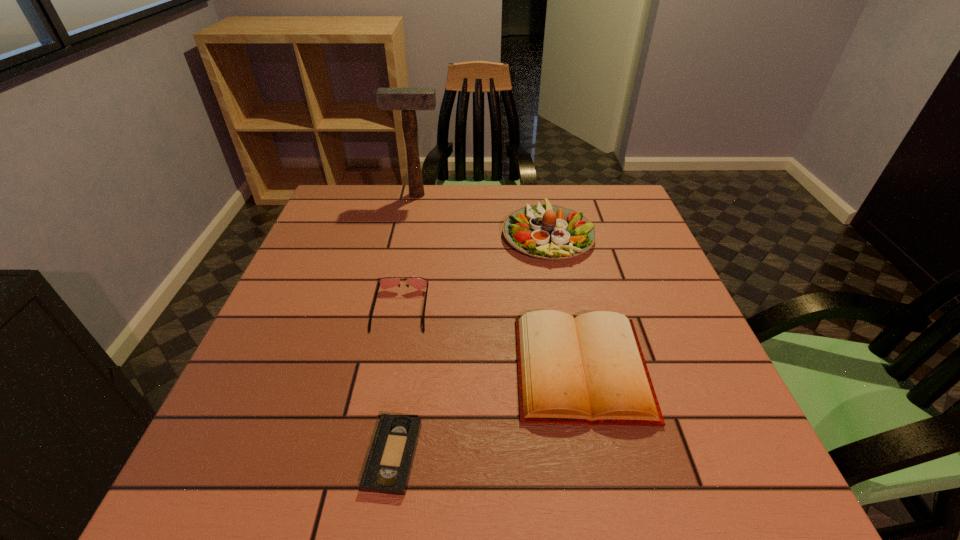
Find the location of a particular element. vacant space situated on the back of the Bible is located at coordinates (558, 257).

This screenshot has width=960, height=540. I want to click on free space located 0.200m on the back of the shortest object, so click(x=412, y=334).

This screenshot has width=960, height=540. Find the location of `mallet situated at the far edge`. mallet situated at the far edge is located at coordinates (408, 100).

The image size is (960, 540). I want to click on salad plate located in the far edge section of the desktop, so click(x=546, y=231).

Locate an element on the screen. Image resolution: width=960 pixels, height=540 pixels. object that is at the near edge is located at coordinates click(389, 463).

Locate an element on the screen. salad plate present at the right edge is located at coordinates (546, 231).

Where is `Bible positioned at the right edge`? Bible positioned at the right edge is located at coordinates (590, 369).

Image resolution: width=960 pixels, height=540 pixels. Identify the location of object present at the far right corner. (546, 231).

In the image, there is a desktop. Identify the location of free space at the far edge. The height and width of the screenshot is (540, 960). (455, 205).

The height and width of the screenshot is (540, 960). In order to click on vacant space at the near edge in this screenshot , I will do `click(286, 503)`.